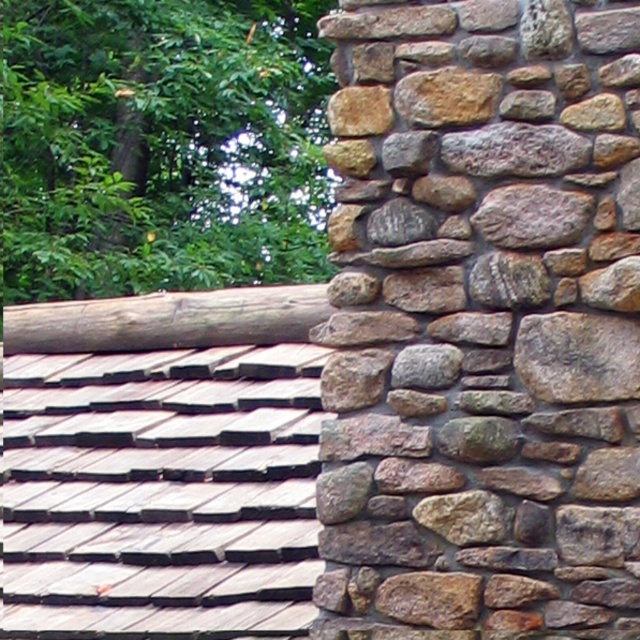
Can you confirm if natural stone wall at right is positioned to the left of brown rough log at upper left?

Incorrect, natural stone wall at right is not on the left side of brown rough log at upper left.

Find the location of a particular element. Image resolution: width=640 pixels, height=640 pixels. natural stone wall at right is located at coordinates (481, 323).

Locate an element on the screen. The width and height of the screenshot is (640, 640). natural stone wall at right is located at coordinates (481, 323).